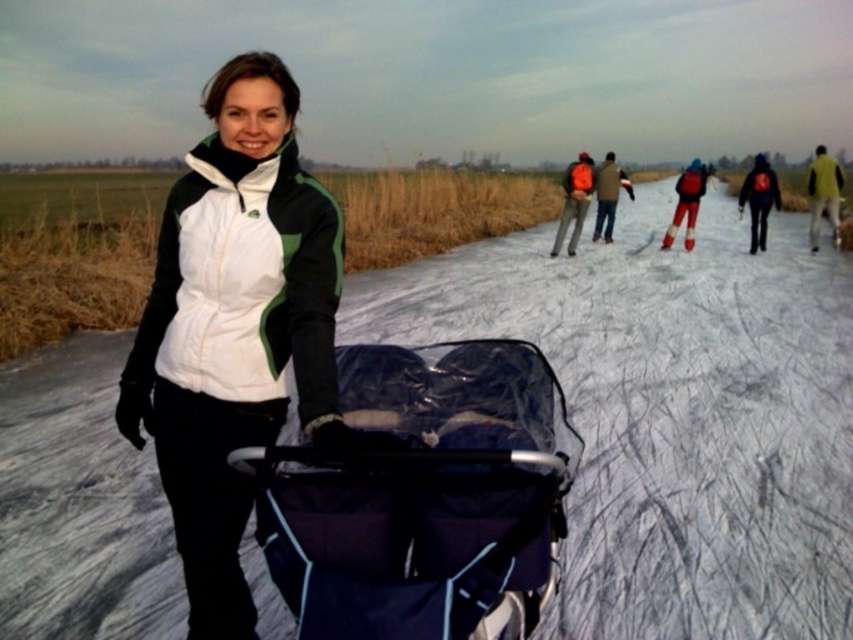
Is point (396, 547) less distant than point (587, 196)?

Yes, it is in front of point (587, 196).

I want to click on dark blue fabric baby carriage at center, so click(422, 497).

Measure the distance between dark blue fabric baby carriage at center and camera.

dark blue fabric baby carriage at center and camera are 4.78 feet apart.

Find the location of a particular element. This screenshot has height=640, width=853. dark blue fabric baby carriage at center is located at coordinates (422, 497).

Between white fleece jacket at center and black matte jacket at upper right, which one has less height?

Standing shorter between the two is white fleece jacket at center.

Is white fleece jacket at center positioned at the back of black matte jacket at upper right?

No, it is in front of black matte jacket at upper right.

I want to click on white fleece jacket at center, so click(234, 326).

Locate an element on the screen. Image resolution: width=853 pixels, height=640 pixels. white fleece jacket at center is located at coordinates coord(234,326).

Does dark blue fabric baby carriage at center have a larger size compared to red snowsuit at center?

Actually, dark blue fabric baby carriage at center might be smaller than red snowsuit at center.

Can you confirm if dark blue fabric baby carriage at center is wider than red snowsuit at center?

Incorrect, dark blue fabric baby carriage at center's width does not surpass red snowsuit at center's.

Locate an element on the screen. This screenshot has height=640, width=853. dark blue fabric baby carriage at center is located at coordinates (422, 497).